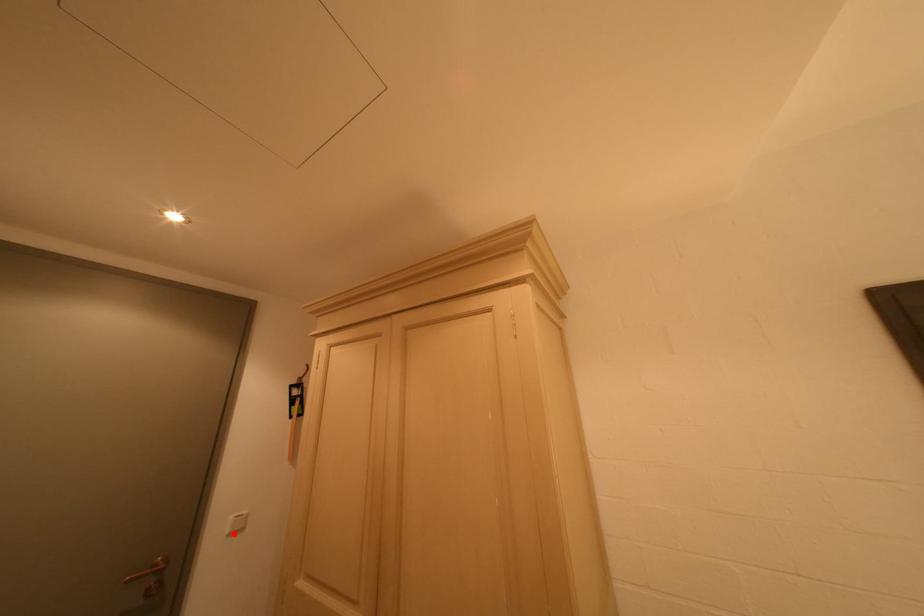
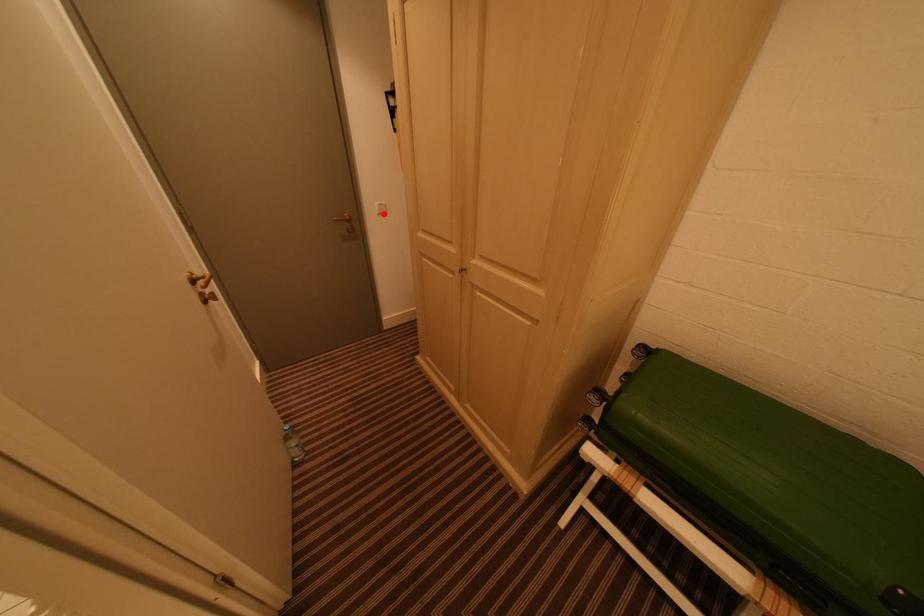
I am providing you with two images of the same scene from different viewpoints. A red point is marked on the first image and another point is marked on the second image. Is the marked point in image1 the same physical position as the marked point in image2?

Yes